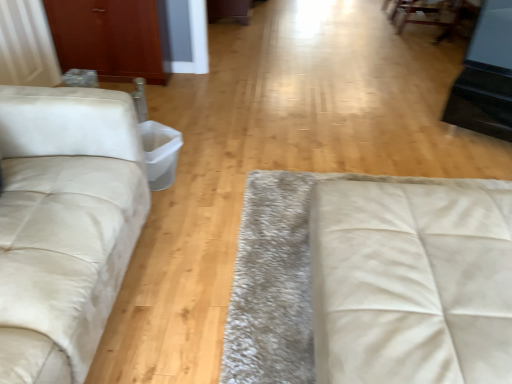
Find the location of a particular element. The height and width of the screenshot is (384, 512). matte wood armoire at upper left is located at coordinates (108, 38).

In order to face matte wood armoire at upper left, should I rotate leftwards or rightwards?

You should look left and rotate roughly 18.450 degrees.

What is the approximate width of white leather studio couch at center, placed as the first studio couch when sorted from right to left?

The width of white leather studio couch at center, placed as the first studio couch when sorted from right to left, is 36.80 inches.

This screenshot has height=384, width=512. In order to click on white leather studio couch at center, acting as the second studio couch starting from the left in this screenshot , I will do `click(411, 283)`.

In order to click on suede-like beige studio couch at left, the second studio couch viewed from the right in this screenshot , I will do click(67, 211).

Looking at this image, is matte wood armoire at upper left facing away from suede-like beige studio couch at left, acting as the 1th studio couch starting from the left?

No.

Can you tell me how much matte wood armoire at upper left and suede-like beige studio couch at left, acting as the 1th studio couch starting from the left, differ in facing direction?

The angle between the facing direction of matte wood armoire at upper left and the facing direction of suede-like beige studio couch at left, acting as the 1th studio couch starting from the left, is 90.3 degrees.

Measure the distance from matte wood armoire at upper left to suede-like beige studio couch at left, acting as the 1th studio couch starting from the left.

matte wood armoire at upper left and suede-like beige studio couch at left, acting as the 1th studio couch starting from the left, are 1.75 meters apart from each other.

Can you confirm if matte wood armoire at upper left is thinner than suede-like beige studio couch at left, the second studio couch viewed from the right?

Yes.

From the image's perspective, is suede-like beige studio couch at left, acting as the 1th studio couch starting from the left, located above or below white leather studio couch at center, acting as the second studio couch starting from the left?

From the image's perspective, suede-like beige studio couch at left, acting as the 1th studio couch starting from the left, appears above white leather studio couch at center, acting as the second studio couch starting from the left.

Measure the distance from suede-like beige studio couch at left, the second studio couch viewed from the right, to white leather studio couch at center, acting as the second studio couch starting from the left.

The distance of suede-like beige studio couch at left, the second studio couch viewed from the right, from white leather studio couch at center, acting as the second studio couch starting from the left, is 37.41 inches.

From a real-world perspective, is suede-like beige studio couch at left, acting as the 1th studio couch starting from the left, located beneath white leather studio couch at center, placed as the first studio couch when sorted from right to left?

Incorrect, from a real-world perspective, suede-like beige studio couch at left, acting as the 1th studio couch starting from the left, is higher than white leather studio couch at center, placed as the first studio couch when sorted from right to left.

Does suede-like beige studio couch at left, the second studio couch viewed from the right, come in front of white leather studio couch at center, acting as the second studio couch starting from the left?

Yes, suede-like beige studio couch at left, the second studio couch viewed from the right, is in front of white leather studio couch at center, acting as the second studio couch starting from the left.

Between white leather studio couch at center, placed as the first studio couch when sorted from right to left, and matte wood armoire at upper left, which one has larger size?

white leather studio couch at center, placed as the first studio couch when sorted from right to left.

Is white leather studio couch at center, acting as the second studio couch starting from the left, wider or thinner than matte wood armoire at upper left?

white leather studio couch at center, acting as the second studio couch starting from the left, is wider than matte wood armoire at upper left.

Could you tell me if white leather studio couch at center, acting as the second studio couch starting from the left, is turned towards matte wood armoire at upper left?

No, white leather studio couch at center, acting as the second studio couch starting from the left, is not facing towards matte wood armoire at upper left.

Does white leather studio couch at center, placed as the first studio couch when sorted from right to left, have a lesser height compared to matte wood armoire at upper left?

Indeed, white leather studio couch at center, placed as the first studio couch when sorted from right to left, has a lesser height compared to matte wood armoire at upper left.

Between white leather studio couch at center, placed as the first studio couch when sorted from right to left, and suede-like beige studio couch at left, the second studio couch viewed from the right, which one has larger size?

suede-like beige studio couch at left, the second studio couch viewed from the right.

Consider the image. Does white leather studio couch at center, placed as the first studio couch when sorted from right to left, have a lesser width compared to suede-like beige studio couch at left, acting as the 1th studio couch starting from the left?

Incorrect, the width of white leather studio couch at center, placed as the first studio couch when sorted from right to left, is not less than that of suede-like beige studio couch at left, acting as the 1th studio couch starting from the left.

Considering the sizes of objects matte wood armoire at upper left and white leather studio couch at center, placed as the first studio couch when sorted from right to left, in the image provided, who is smaller, matte wood armoire at upper left or white leather studio couch at center, placed as the first studio couch when sorted from right to left,?

With smaller size is matte wood armoire at upper left.

Looking at their sizes, would you say matte wood armoire at upper left is wider or thinner than white leather studio couch at center, placed as the first studio couch when sorted from right to left?

Clearly, matte wood armoire at upper left has less width compared to white leather studio couch at center, placed as the first studio couch when sorted from right to left.

Is matte wood armoire at upper left beside white leather studio couch at center, acting as the second studio couch starting from the left?

No, matte wood armoire at upper left is not making contact with white leather studio couch at center, acting as the second studio couch starting from the left.

Image resolution: width=512 pixels, height=384 pixels. In order to click on studio couch that is the 2nd object located below the matte wood armoire at upper left (from the image's perspective) in this screenshot , I will do `click(411, 283)`.

This screenshot has width=512, height=384. I want to click on studio couch above the matte wood armoire at upper left (from a real-world perspective), so click(x=67, y=211).

Who is taller, suede-like beige studio couch at left, the second studio couch viewed from the right, or matte wood armoire at upper left?

suede-like beige studio couch at left, the second studio couch viewed from the right.

Is suede-like beige studio couch at left, acting as the 1th studio couch starting from the left, to the left or to the right of matte wood armoire at upper left in the image?

In the image, suede-like beige studio couch at left, acting as the 1th studio couch starting from the left, appears on the right side of matte wood armoire at upper left.

From the matte wood armoire at upper left, count 1st studio couch to the right and point to it. Please provide its 2D coordinates.

[(67, 211)]

Identify the location of studio couch on the left of white leather studio couch at center, acting as the second studio couch starting from the left. (67, 211).

From the picture: Which object lies nearer to the anchor point white leather studio couch at center, placed as the first studio couch when sorted from right to left, suede-like beige studio couch at left, the second studio couch viewed from the right, or matte wood armoire at upper left?

Among the two, suede-like beige studio couch at left, the second studio couch viewed from the right, is located nearer to white leather studio couch at center, placed as the first studio couch when sorted from right to left.

Considering their positions, is matte wood armoire at upper left positioned closer to suede-like beige studio couch at left, the second studio couch viewed from the right, than white leather studio couch at center, placed as the first studio couch when sorted from right to left?

Based on the image, white leather studio couch at center, placed as the first studio couch when sorted from right to left, appears to be nearer to suede-like beige studio couch at left, the second studio couch viewed from the right.

Which object lies nearer to the anchor point white leather studio couch at center, placed as the first studio couch when sorted from right to left, matte wood armoire at upper left or suede-like beige studio couch at left, acting as the 1th studio couch starting from the left?

Based on the image, suede-like beige studio couch at left, acting as the 1th studio couch starting from the left, appears to be nearer to white leather studio couch at center, placed as the first studio couch when sorted from right to left.

Estimate the real-world distances between objects in this image. Which object is further from suede-like beige studio couch at left, the second studio couch viewed from the right, white leather studio couch at center, acting as the second studio couch starting from the left, or matte wood armoire at upper left?

Based on the image, matte wood armoire at upper left appears to be further to suede-like beige studio couch at left, the second studio couch viewed from the right.

From the image, which object appears to be farther from matte wood armoire at upper left, white leather studio couch at center, acting as the second studio couch starting from the left, or suede-like beige studio couch at left, the second studio couch viewed from the right?

white leather studio couch at center, acting as the second studio couch starting from the left, lies further to matte wood armoire at upper left than the other object.

From the image, which object appears to be nearer to matte wood armoire at upper left, suede-like beige studio couch at left, acting as the 1th studio couch starting from the left, or white leather studio couch at center, acting as the second studio couch starting from the left?

suede-like beige studio couch at left, acting as the 1th studio couch starting from the left, lies closer to matte wood armoire at upper left than the other object.

Locate an element on the screen. The height and width of the screenshot is (384, 512). studio couch between suede-like beige studio couch at left, the second studio couch viewed from the right, and matte wood armoire at upper left in the front-back direction is located at coordinates (411, 283).